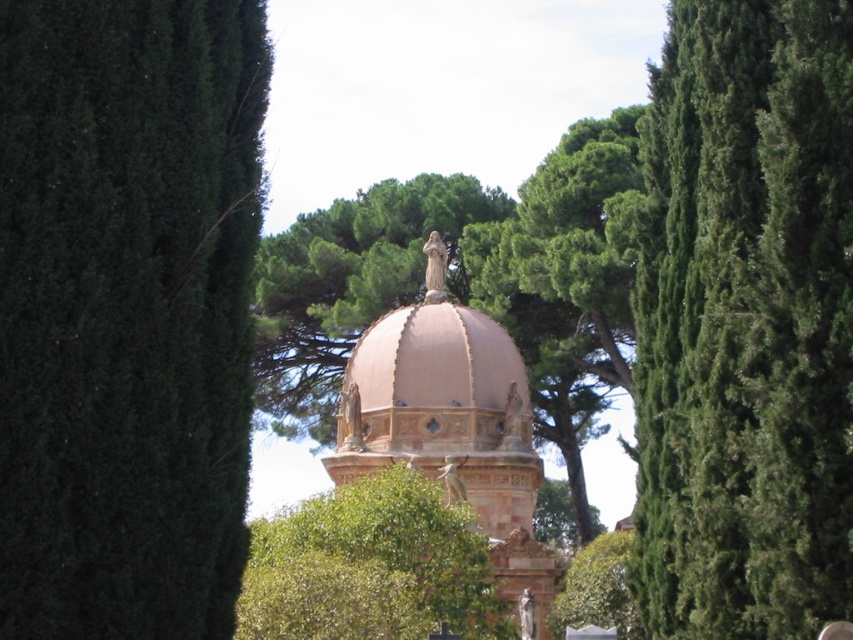
You are a visitor standing in front of the pink stone dome at center and looking towards the green textured tree at right. Which object is higher in your field of view?

The green textured tree at right is located above the pink stone dome at center, so it is higher in your field of view.

You are standing in the outdoor scene and want to walk from the point at coordinates point (428, 340) to the point at coordinates point (491, 612). Which direction should you face to move towards the second point?

You should face away from the dome structure because point (491, 612) is further away from the viewer than point (428, 340).